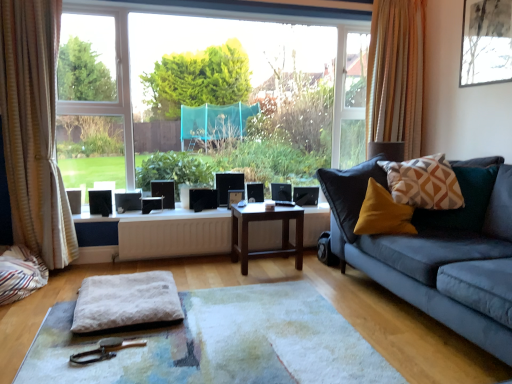
The width and height of the screenshot is (512, 384). Identify the location of vacant area situated to the left side of brown wooden table at center. (212, 271).